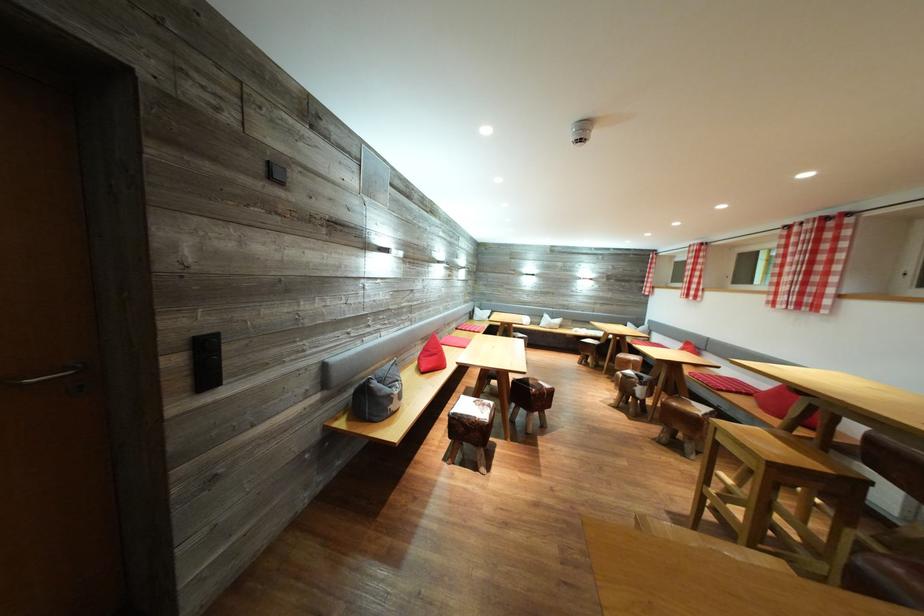
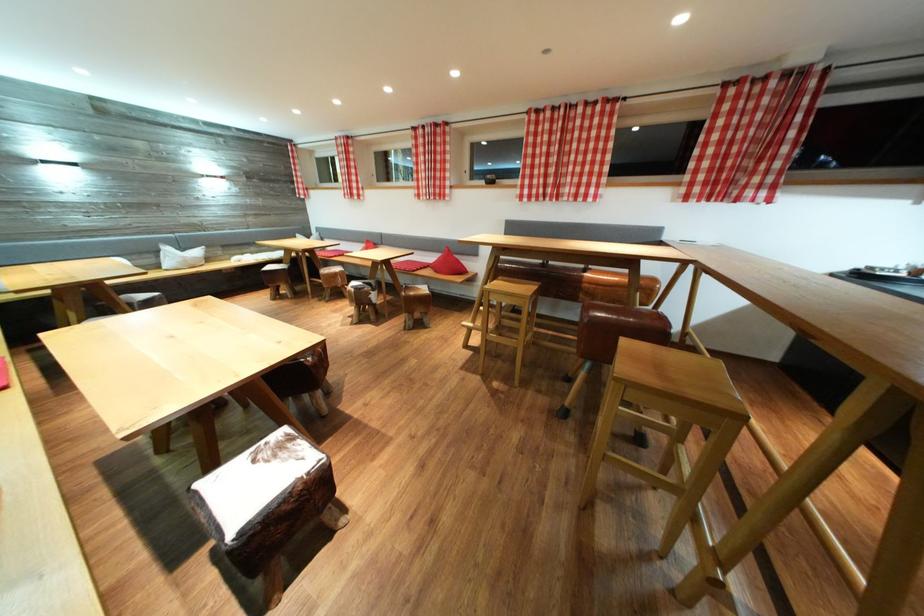
Locate, in the second image, the point that corresponds to point 631,381 in the first image.

(362, 294)